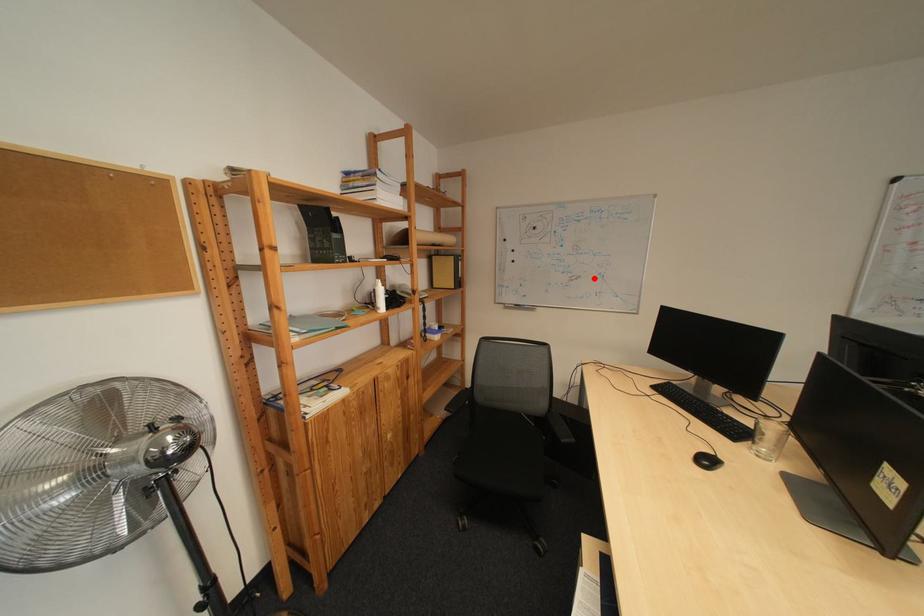
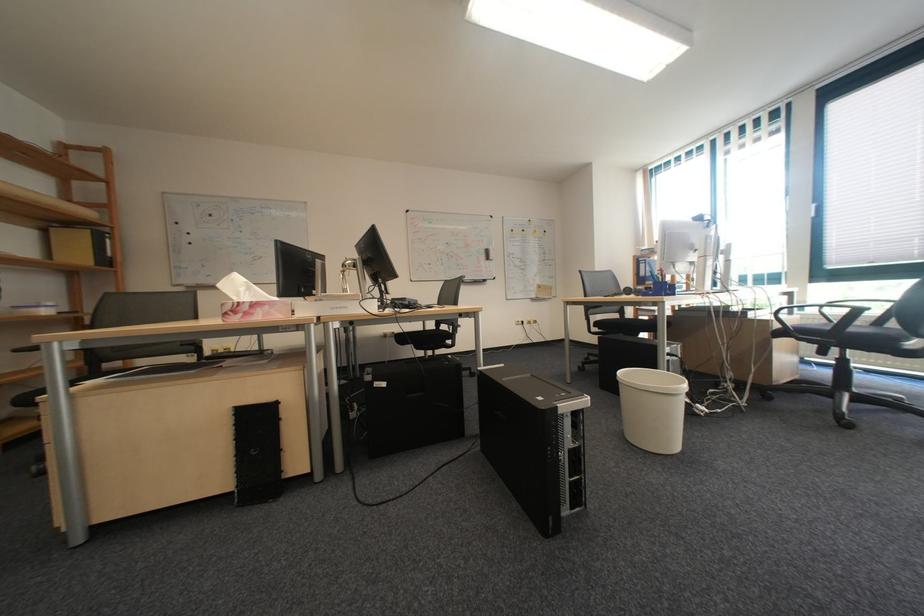
In the second image, find the point that corresponds to the highlighted location in the first image.

(275, 257)